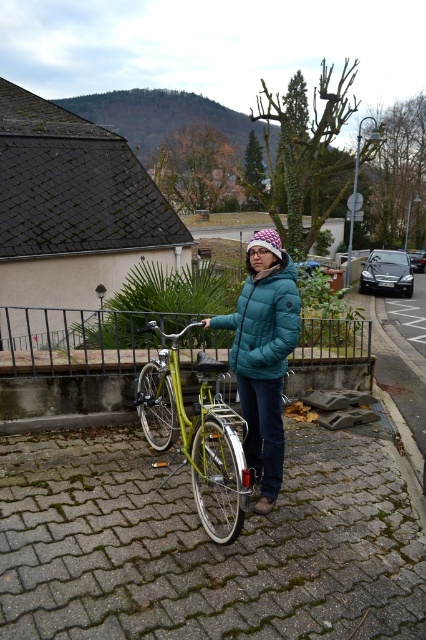
Does green matte bicycle at center have a lesser width compared to teal down jacket at center?

No.

Is point (201, 483) behind point (293, 340)?

Yes.

Find the location of a particular element. The width and height of the screenshot is (426, 640). green matte bicycle at center is located at coordinates (195, 426).

Does teal quilted jacket at center have a greater width compared to green matte bicycle at center?

In fact, teal quilted jacket at center might be narrower than green matte bicycle at center.

Can you confirm if teal quilted jacket at center is positioned to the right of green matte bicycle at center?

Indeed, teal quilted jacket at center is positioned on the right side of green matte bicycle at center.

I want to click on teal quilted jacket at center, so pos(264,355).

Does teal quilted jacket at center have a smaller size compared to teal down jacket at center?

No, teal quilted jacket at center is not smaller than teal down jacket at center.

Who is more distant from viewer, (290, 282) or (290, 269)?

Positioned behind is point (290, 269).

Find the location of `teal quilted jacket at center`. teal quilted jacket at center is located at coordinates (264, 355).